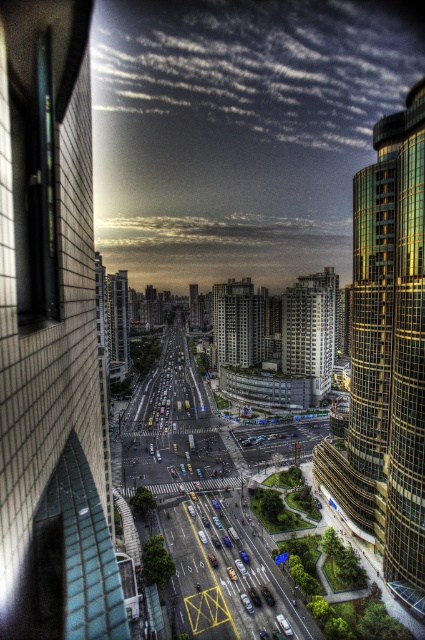
Does brick wall at left have a greater height compared to dark gray concrete building at center?

Yes, brick wall at left is taller than dark gray concrete building at center.

Who is more distant from viewer, (x=87, y=582) or (x=336, y=284)?

Point (x=336, y=284)

Does point (73, 253) come behind point (320, 374)?

No, it is in front of (320, 374).

Image resolution: width=425 pixels, height=640 pixels. What are the coordinates of `brick wall at left` in the screenshot? It's located at (51, 337).

Can you confirm if white concrete building at center is wider than gold reflective glass building at center?

Yes, white concrete building at center is wider than gold reflective glass building at center.

Which is more to the left, white concrete building at center or gold reflective glass building at center?

Positioned to the left is gold reflective glass building at center.

Who is more distant from viewer, [215,314] or [113,340]?

The point [215,314] is more distant.

The width and height of the screenshot is (425, 640). Find the location of `white concrete building at center`. white concrete building at center is located at coordinates (238, 323).

Is brick wall at left closer to camera compared to gold reflective glass building at center?

Yes, it is in front of gold reflective glass building at center.

Does brick wall at left have a smaller size compared to gold reflective glass building at center?

No.

Locate an element on the screen. brick wall at left is located at coordinates (51, 337).

This screenshot has height=640, width=425. I want to click on brick wall at left, so click(x=51, y=337).